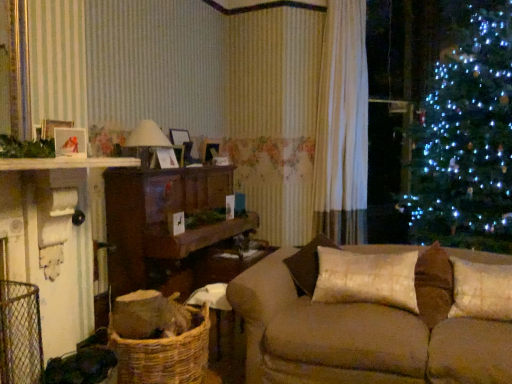
Question: From the image's perspective, would you say woven brown basket at lower left is shown under white textured pillow at right, the first pillow viewed from the right?

Choices:
 (A) yes
 (B) no

Answer: (A)

Question: Is woven brown basket at lower left turned away from white textured pillow at right, positioned as the 2th pillow in left-to-right order?

Choices:
 (A) no
 (B) yes

Answer: (A)

Question: Does woven brown basket at lower left have a greater width compared to white textured pillow at right, positioned as the 2th pillow in left-to-right order?

Choices:
 (A) yes
 (B) no

Answer: (A)

Question: Can white textured pillow at right, the first pillow viewed from the right, be found inside woven brown basket at lower left?

Choices:
 (A) no
 (B) yes

Answer: (A)

Question: Could you tell me if woven brown basket at lower left is turned towards white textured pillow at right, positioned as the 2th pillow in left-to-right order?

Choices:
 (A) yes
 (B) no

Answer: (B)

Question: Considering the relative positions of woven brown basket at lower left and white textured pillow at right, positioned as the 2th pillow in left-to-right order, in the image provided, is woven brown basket at lower left to the left of white textured pillow at right, positioned as the 2th pillow in left-to-right order, from the viewer's perspective?

Choices:
 (A) no
 (B) yes

Answer: (B)

Question: Considering the relative sizes of matte white lampshade at center and white textured pillow at right, the first pillow viewed from the right, in the image provided, is matte white lampshade at center bigger than white textured pillow at right, the first pillow viewed from the right,?

Choices:
 (A) no
 (B) yes

Answer: (B)

Question: Is the position of matte white lampshade at center more distant than that of white textured pillow at right, positioned as the 2th pillow in left-to-right order?

Choices:
 (A) yes
 (B) no

Answer: (A)

Question: From the image's perspective, is matte white lampshade at center below white textured pillow at right, positioned as the 2th pillow in left-to-right order?

Choices:
 (A) no
 (B) yes

Answer: (A)

Question: Does matte white lampshade at center appear on the left side of white textured pillow at right, positioned as the 2th pillow in left-to-right order?

Choices:
 (A) yes
 (B) no

Answer: (A)

Question: Considering the relative positions of matte white lampshade at center and white textured pillow at right, positioned as the 2th pillow in left-to-right order, in the image provided, is matte white lampshade at center to the right of white textured pillow at right, positioned as the 2th pillow in left-to-right order, from the viewer's perspective?

Choices:
 (A) no
 (B) yes

Answer: (A)

Question: Is matte white lampshade at center beside white textured pillow at right, positioned as the 2th pillow in left-to-right order?

Choices:
 (A) no
 (B) yes

Answer: (A)

Question: From the image's perspective, is brown fabric couch at center below woven brown basket at lower left?

Choices:
 (A) no
 (B) yes

Answer: (A)